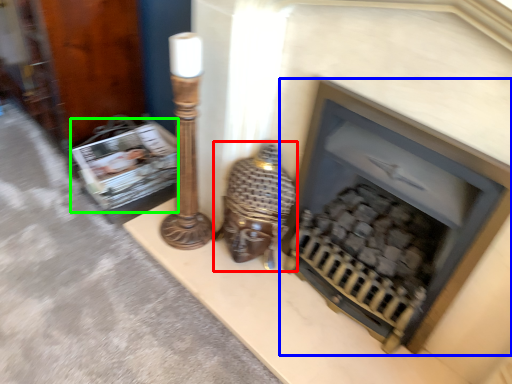
Question: Estimate the real-world distances between objects in this image. Which object is closer to table lamp (highlighted by a red box), fireplace (highlighted by a blue box) or magazine (highlighted by a green box)?

Choices:
 (A) fireplace
 (B) magazine

Answer: (A)